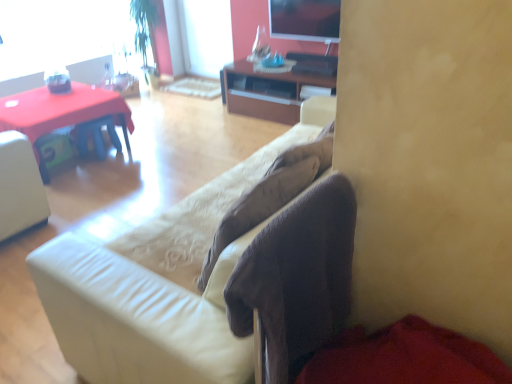
Question: Considering the relative sizes of brown wood cabinet at center and suede-like beige couch at center in the image provided, is brown wood cabinet at center shorter than suede-like beige couch at center?

Choices:
 (A) no
 (B) yes

Answer: (B)

Question: Is brown wood cabinet at center turned away from suede-like beige couch at center?

Choices:
 (A) no
 (B) yes

Answer: (A)

Question: Does brown wood cabinet at center touch suede-like beige couch at center?

Choices:
 (A) no
 (B) yes

Answer: (A)

Question: Is brown wood cabinet at center facing towards suede-like beige couch at center?

Choices:
 (A) no
 (B) yes

Answer: (B)

Question: Can you confirm if brown wood cabinet at center is wider than suede-like beige couch at center?

Choices:
 (A) no
 (B) yes

Answer: (A)

Question: Looking at the image, does brown wood cabinet at center seem bigger or smaller compared to matte black tv at upper center?

Choices:
 (A) big
 (B) small

Answer: (A)

Question: From a real-world perspective, relative to matte black tv at upper center, is brown wood cabinet at center vertically above or below?

Choices:
 (A) below
 (B) above

Answer: (A)

Question: Is point (275, 77) positioned closer to the camera than point (315, 3)?

Choices:
 (A) farther
 (B) closer

Answer: (A)

Question: Based on their positions, is brown wood cabinet at center located to the left or right of matte black tv at upper center?

Choices:
 (A) right
 (B) left

Answer: (B)

Question: Considering their positions, is matte plastic desk at left located in front of or behind matte black tv at upper center?

Choices:
 (A) behind
 (B) front

Answer: (B)

Question: Which is correct: matte plastic desk at left is inside matte black tv at upper center, or outside of it?

Choices:
 (A) outside
 (B) inside

Answer: (A)

Question: Looking at their shapes, would you say matte plastic desk at left is wider or thinner than matte black tv at upper center?

Choices:
 (A) wide
 (B) thin

Answer: (A)

Question: Is matte plastic desk at left taller or shorter than matte black tv at upper center?

Choices:
 (A) short
 (B) tall

Answer: (B)

Question: Considering the positions of suede-like beige couch at center and matte plastic desk at left in the image, is suede-like beige couch at center taller or shorter than matte plastic desk at left?

Choices:
 (A) tall
 (B) short

Answer: (A)

Question: Is suede-like beige couch at center bigger or smaller than matte plastic desk at left?

Choices:
 (A) small
 (B) big

Answer: (B)